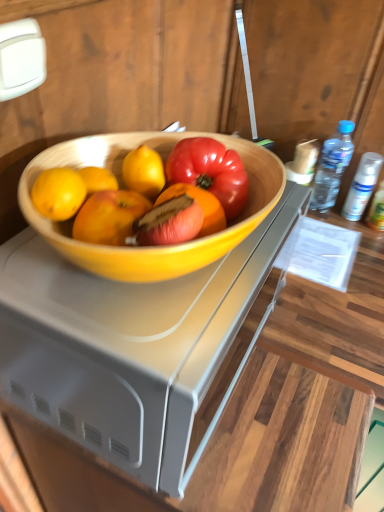
Image resolution: width=384 pixels, height=512 pixels. Describe the element at coordinates (377, 210) in the screenshot. I see `clear plastic spray can at upper right, the 3th bottle when ordered from left to right` at that location.

This screenshot has width=384, height=512. What do you see at coordinates (131, 348) in the screenshot?
I see `wooden desk at center` at bounding box center [131, 348].

Where is `clear plastic spray can at upper right, which is the 1th bottle in right-to-left order`? The height and width of the screenshot is (512, 384). clear plastic spray can at upper right, which is the 1th bottle in right-to-left order is located at coordinates (377, 210).

Is white matte spray can at right, acting as the second bottle starting from the right, looking in the opposite direction of clear plastic spray can at upper right, which is the 1th bottle in right-to-left order?

No, white matte spray can at right, acting as the second bottle starting from the right,'s orientation is not away from clear plastic spray can at upper right, which is the 1th bottle in right-to-left order.

Based on the photo, would you say clear plastic spray can at upper right, which is the 1th bottle in right-to-left order, is part of white matte spray can at right, acting as the second bottle starting from the right,'s contents?

Definitely not — clear plastic spray can at upper right, which is the 1th bottle in right-to-left order, is not inside white matte spray can at right, acting as the second bottle starting from the right.

Considering the relative positions of white matte spray can at right, which is the 2th bottle in left-to-right order, and clear plastic spray can at upper right, the 3th bottle when ordered from left to right, in the image provided, is white matte spray can at right, which is the 2th bottle in left-to-right order, to the right of clear plastic spray can at upper right, the 3th bottle when ordered from left to right, from the viewer's perspective?

Answer: In fact, white matte spray can at right, which is the 2th bottle in left-to-right order, is to the left of clear plastic spray can at upper right, the 3th bottle when ordered from left to right.

Consider the image. From a real-world perspective, who is located lower, white matte spray can at right, which is the 2th bottle in left-to-right order, or clear plastic spray can at upper right, which is the 1th bottle in right-to-left order?

In real-world perspective, white matte spray can at right, which is the 2th bottle in left-to-right order, is lower.

Is clear plastic spray can at upper right, which is the 1th bottle in right-to-left order, positioned beyond the bounds of wooden desk at center?

Yes, clear plastic spray can at upper right, which is the 1th bottle in right-to-left order, is outside of wooden desk at center.

Which of these two, clear plastic spray can at upper right, the 3th bottle when ordered from left to right, or wooden desk at center, is bigger?

wooden desk at center.

Does clear plastic spray can at upper right, the 3th bottle when ordered from left to right, lie in front of wooden desk at center?

No, it is not.

How different are the orientations of clear plastic spray can at upper right, which is the 1th bottle in right-to-left order, and wooden desk at center in degrees?

clear plastic spray can at upper right, which is the 1th bottle in right-to-left order, and wooden desk at center are facing 88 degrees away from each other.

From a real-world perspective, is wooden desk at center under transparent plastic bottle at right, the 3th bottle viewed from the right?

No.

Looking at their sizes, would you say wooden desk at center is wider or thinner than transparent plastic bottle at right, the 1th bottle when ordered from left to right?

Considering their sizes, wooden desk at center looks broader than transparent plastic bottle at right, the 1th bottle when ordered from left to right.

Looking at this image, are wooden desk at center and transparent plastic bottle at right, the 1th bottle when ordered from left to right, located far from each other?

No, wooden desk at center is not far away from transparent plastic bottle at right, the 1th bottle when ordered from left to right.

Looking at this image, is transparent plastic bottle at right, the 1th bottle when ordered from left to right, further to camera compared to clear plastic spray can at upper right, which is the 1th bottle in right-to-left order?

Yes, transparent plastic bottle at right, the 1th bottle when ordered from left to right, is behind clear plastic spray can at upper right, which is the 1th bottle in right-to-left order.

Does transparent plastic bottle at right, the 1th bottle when ordered from left to right, have a greater height compared to clear plastic spray can at upper right, the 3th bottle when ordered from left to right?

Indeed, transparent plastic bottle at right, the 1th bottle when ordered from left to right, has a greater height compared to clear plastic spray can at upper right, the 3th bottle when ordered from left to right.

From the picture: Does transparent plastic bottle at right, the 1th bottle when ordered from left to right, appear on the left side of clear plastic spray can at upper right, which is the 1th bottle in right-to-left order?

Yes, transparent plastic bottle at right, the 1th bottle when ordered from left to right, is to the left of clear plastic spray can at upper right, which is the 1th bottle in right-to-left order.

Are clear plastic spray can at upper right, the 3th bottle when ordered from left to right, and transparent plastic bottle at right, the 1th bottle when ordered from left to right, located far from each other?

No, there isn't a large distance between clear plastic spray can at upper right, the 3th bottle when ordered from left to right, and transparent plastic bottle at right, the 1th bottle when ordered from left to right.

Is clear plastic spray can at upper right, the 3th bottle when ordered from left to right, turned away from transparent plastic bottle at right, the 3th bottle viewed from the right?

No.

This screenshot has height=512, width=384. What are the coordinates of `the 2nd bottle positioned below the transparent plastic bottle at right, the 1th bottle when ordered from left to right (from the image's perspective)` in the screenshot? It's located at point(377,210).

Considering the sizes of objects clear plastic spray can at upper right, the 3th bottle when ordered from left to right, and transparent plastic bottle at right, the 3th bottle viewed from the right, in the image provided, who is bigger, clear plastic spray can at upper right, the 3th bottle when ordered from left to right, or transparent plastic bottle at right, the 3th bottle viewed from the right,?

transparent plastic bottle at right, the 3th bottle viewed from the right, is bigger.

From a real-world perspective, between wooden desk at center and white matte spray can at right, acting as the second bottle starting from the right, who is vertically higher?

From a 3D spatial view, wooden desk at center is above.

Considering the relative sizes of wooden desk at center and white matte spray can at right, which is the 2th bottle in left-to-right order, in the image provided, is wooden desk at center smaller than white matte spray can at right, which is the 2th bottle in left-to-right order,?

No.

Would you say wooden desk at center is a long distance from white matte spray can at right, which is the 2th bottle in left-to-right order?

No.

Measure the distance between wooden desk at center and white matte spray can at right, which is the 2th bottle in left-to-right order.

They are 27.85 inches apart.

Does wooden desk at center have a lesser height compared to clear plastic spray can at upper right, the 3th bottle when ordered from left to right?

Incorrect, the height of wooden desk at center does not fall short of that of clear plastic spray can at upper right, the 3th bottle when ordered from left to right.

Is point (159, 301) positioned before point (375, 203)?

Yes, point (159, 301) is closer to viewer.

Are wooden desk at center and clear plastic spray can at upper right, the 3th bottle when ordered from left to right, far apart?

No, wooden desk at center is not far away from clear plastic spray can at upper right, the 3th bottle when ordered from left to right.

From the image's perspective, is wooden desk at center on top of clear plastic spray can at upper right, which is the 1th bottle in right-to-left order?

No, from the image's perspective, wooden desk at center is not over clear plastic spray can at upper right, which is the 1th bottle in right-to-left order.

Where is `the 1st bottle directly above the white matte spray can at right, which is the 2th bottle in left-to-right order (from a real-world perspective)`? The width and height of the screenshot is (384, 512). the 1st bottle directly above the white matte spray can at right, which is the 2th bottle in left-to-right order (from a real-world perspective) is located at coordinates (377, 210).

You are a GUI agent. You are given a task and a screenshot of the screen. Output one action in this format:
    pyautogui.click(x=<x>, y=<y>)
    Task: Click on the desk located in front of the clear plastic spray can at upper right, the 3th bottle when ordered from left to right
    The height and width of the screenshot is (512, 384).
    Given the screenshot: What is the action you would take?
    pyautogui.click(x=131, y=348)

From the picture: From the image, which object appears to be farther from white matte spray can at right, which is the 2th bottle in left-to-right order, wooden desk at center or transparent plastic bottle at right, the 3th bottle viewed from the right?

wooden desk at center is positioned further to the anchor white matte spray can at right, which is the 2th bottle in left-to-right order.

From the image, which object appears to be farther from clear plastic spray can at upper right, the 3th bottle when ordered from left to right, white matte spray can at right, acting as the second bottle starting from the right, or wooden desk at center?

wooden desk at center lies further to clear plastic spray can at upper right, the 3th bottle when ordered from left to right, than the other object.

Estimate the real-world distances between objects in this image. Which object is closer to white matte spray can at right, acting as the second bottle starting from the right, wooden desk at center or clear plastic spray can at upper right, the 3th bottle when ordered from left to right?

clear plastic spray can at upper right, the 3th bottle when ordered from left to right, is closer to white matte spray can at right, acting as the second bottle starting from the right.

From the image, which object appears to be nearer to white matte spray can at right, acting as the second bottle starting from the right, transparent plastic bottle at right, the 1th bottle when ordered from left to right, or wooden desk at center?

transparent plastic bottle at right, the 1th bottle when ordered from left to right.

Based on their spatial positions, is white matte spray can at right, acting as the second bottle starting from the right, or wooden desk at center closer to transparent plastic bottle at right, the 3th bottle viewed from the right?

white matte spray can at right, acting as the second bottle starting from the right, is closer to transparent plastic bottle at right, the 3th bottle viewed from the right.

When comparing their distances from white matte spray can at right, which is the 2th bottle in left-to-right order, does transparent plastic bottle at right, the 3th bottle viewed from the right, or clear plastic spray can at upper right, which is the 1th bottle in right-to-left order, seem closer?

clear plastic spray can at upper right, which is the 1th bottle in right-to-left order.

From the image, which object appears to be nearer to wooden desk at center, clear plastic spray can at upper right, the 3th bottle when ordered from left to right, or transparent plastic bottle at right, the 3th bottle viewed from the right?

Based on the image, transparent plastic bottle at right, the 3th bottle viewed from the right, appears to be nearer to wooden desk at center.

Looking at the image, which one is located closer to wooden desk at center, clear plastic spray can at upper right, the 3th bottle when ordered from left to right, or white matte spray can at right, acting as the second bottle starting from the right?

Based on the image, white matte spray can at right, acting as the second bottle starting from the right, appears to be nearer to wooden desk at center.

Image resolution: width=384 pixels, height=512 pixels. In order to click on bottle located between transparent plastic bottle at right, the 1th bottle when ordered from left to right, and clear plastic spray can at upper right, which is the 1th bottle in right-to-left order, in the left-right direction in this screenshot , I will do `click(362, 186)`.

Where is `bottle between wooden desk at center and transparent plastic bottle at right, the 3th bottle viewed from the right, from front to back`? The width and height of the screenshot is (384, 512). bottle between wooden desk at center and transparent plastic bottle at right, the 3th bottle viewed from the right, from front to back is located at coordinates (377, 210).